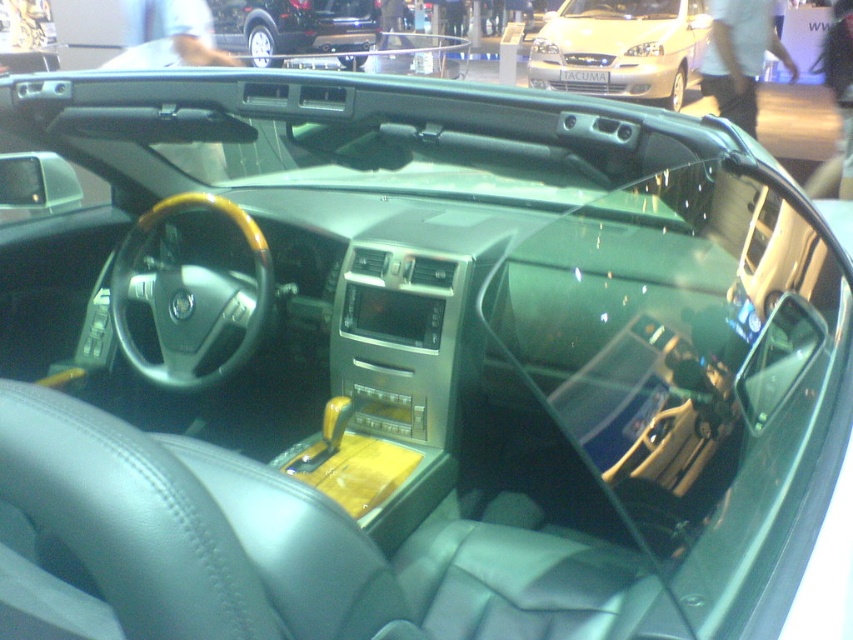
Question: Which point is farther to the camera?

Choices:
 (A) (682, 4)
 (B) (241, 36)

Answer: (B)

Question: Which of the following is the farthest from the observer?

Choices:
 (A) (238, 44)
 (B) (634, 10)

Answer: (A)

Question: Which point is farther to the camera?

Choices:
 (A) (677, 29)
 (B) (341, 33)

Answer: (B)

Question: Can you confirm if silver metallic sedan at upper center is bigger than shiny black car at upper center?

Choices:
 (A) no
 (B) yes

Answer: (B)

Question: Does silver metallic sedan at upper center appear over shiny black car at upper center?

Choices:
 (A) no
 (B) yes

Answer: (A)

Question: Does silver metallic sedan at upper center have a larger size compared to shiny black car at upper center?

Choices:
 (A) yes
 (B) no

Answer: (A)